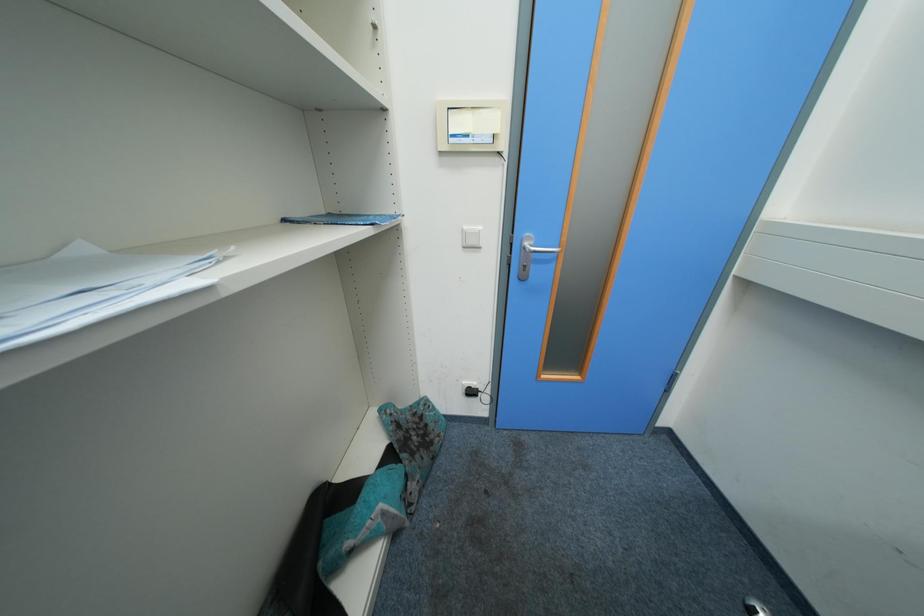
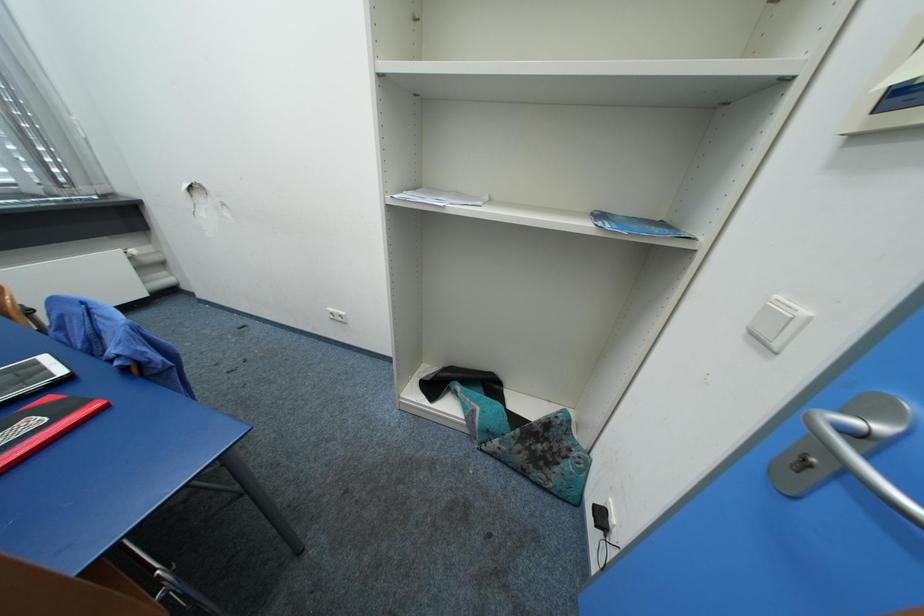
In the scene shown: The first image is from the beginning of the video and the second image is from the end. How did the camera likely rotate when shooting the video?

The rotation direction of the camera is left-down.